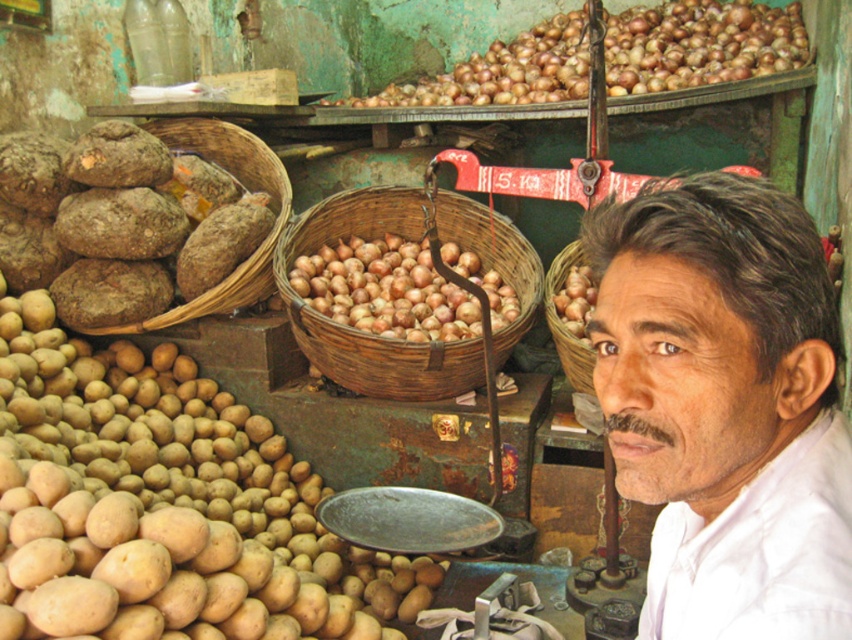
Question: Which is farther from the natural brown woven basket at center?

Choices:
 (A) brown woven basket at left
 (B) brown matte onions at center
 (C) brown woven basket at center
 (D) white matte shirt at upper right

Answer: (D)

Question: Where is brown matte onions at upper center located in relation to natural brown woven basket at center in the image?

Choices:
 (A) left
 (B) right

Answer: (B)

Question: Which point is closer to the camera?

Choices:
 (A) (563, 268)
 (B) (387, 364)
 (C) (353, 321)

Answer: (B)

Question: Can you confirm if brown woven basket at left is positioned to the right of natural brown woven basket at center?

Choices:
 (A) yes
 (B) no

Answer: (B)

Question: Is brown woven basket at center smaller than brown woven basket at left?

Choices:
 (A) yes
 (B) no

Answer: (B)

Question: Among these points, which one is nearest to the camera?

Choices:
 (A) (568, 332)
 (B) (705, 17)

Answer: (A)